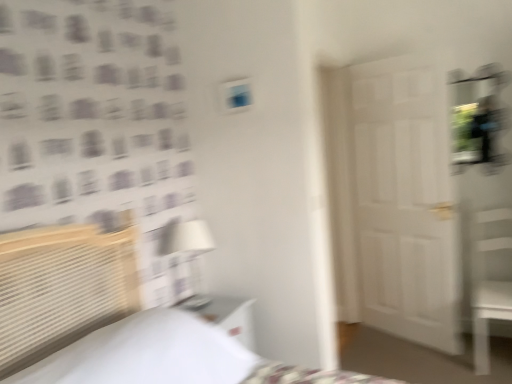
Question: Is white glossy nightstand at lower center facing towards white matte door at center?

Choices:
 (A) no
 (B) yes

Answer: (A)

Question: Can we say white glossy nightstand at lower center lies outside white matte door at center?

Choices:
 (A) no
 (B) yes

Answer: (B)

Question: Is white glossy nightstand at lower center next to white matte door at center and touching it?

Choices:
 (A) yes
 (B) no

Answer: (B)

Question: From a real-world perspective, is white glossy nightstand at lower center positioned over white matte door at center based on gravity?

Choices:
 (A) yes
 (B) no

Answer: (B)

Question: Does white glossy nightstand at lower center have a lesser height compared to white matte door at center?

Choices:
 (A) yes
 (B) no

Answer: (A)

Question: Is white glossy nightstand at lower center at the right side of white matte door at center?

Choices:
 (A) yes
 (B) no

Answer: (B)

Question: Is the surface of white matte door at center in direct contact with white woven bed at left?

Choices:
 (A) no
 (B) yes

Answer: (A)

Question: Considering the relative sizes of white matte door at center and white woven bed at left in the image provided, is white matte door at center bigger than white woven bed at left?

Choices:
 (A) no
 (B) yes

Answer: (A)

Question: Is white matte door at center closer to camera compared to white woven bed at left?

Choices:
 (A) no
 (B) yes

Answer: (A)

Question: Considering the relative sizes of white matte door at center and white woven bed at left in the image provided, is white matte door at center wider than white woven bed at left?

Choices:
 (A) yes
 (B) no

Answer: (B)

Question: Is white woven bed at left at the back of white matte door at center?

Choices:
 (A) no
 (B) yes

Answer: (A)

Question: Can you confirm if white matte door at center is shorter than white woven bed at left?

Choices:
 (A) yes
 (B) no

Answer: (B)

Question: Can you confirm if white fabric lampshade at center is taller than white glossy nightstand at lower center?

Choices:
 (A) yes
 (B) no

Answer: (A)